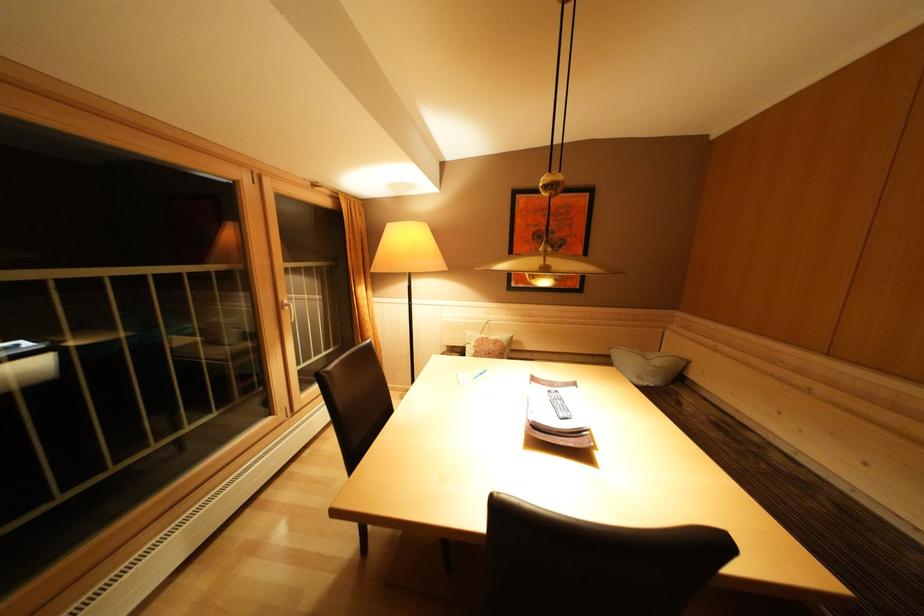
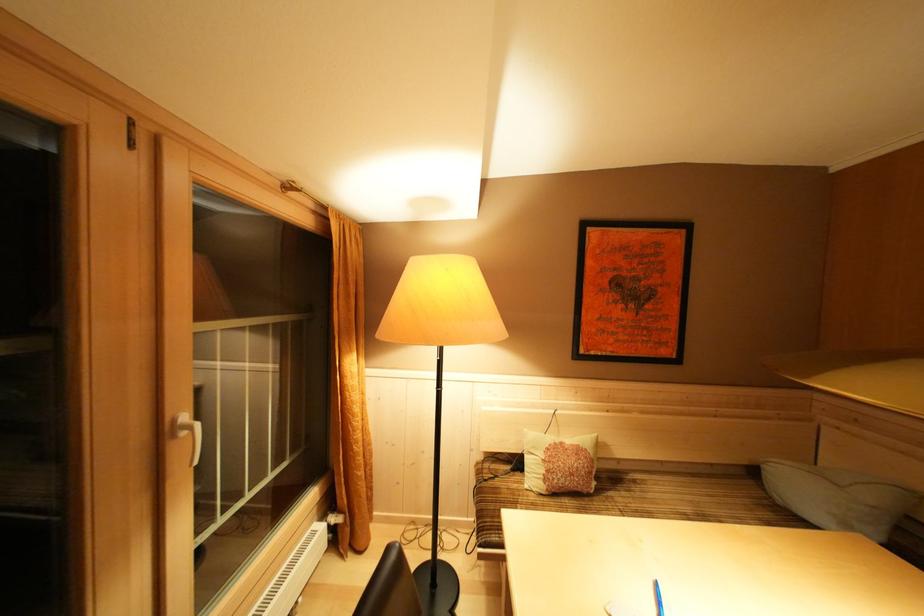
In the second image, find the point that corresponds to point 368,289 in the first image.

(358, 357)